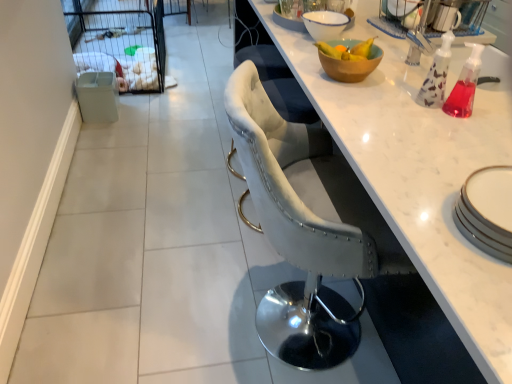
Where is `vacant space underneath velvet grey chair at center (from a real-world perspective)`? vacant space underneath velvet grey chair at center (from a real-world perspective) is located at coordinates pos(285,298).